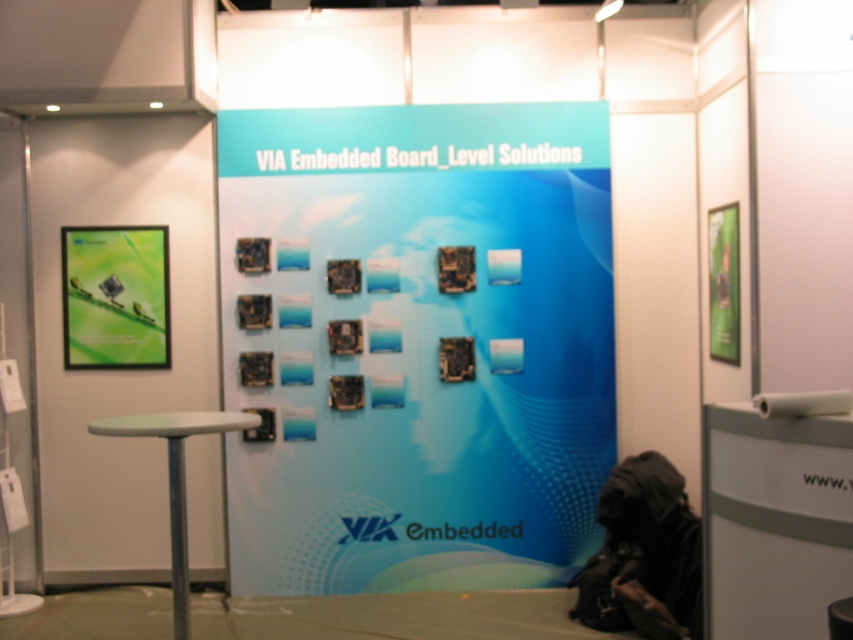
You are standing in front of the exhibition booth and want to locate the blue glossy board at center. According to the coordinates provided, where exactly is it positioned?

The blue glossy board at center is positioned at point coordinates of (415, 342).

You are setting up a new display in the exhibition booth and need to place a rectangular stand that is 1.2 meters wide. You have two options for placement areas based on the existing blue glossy board at center and green glossy poster at upper left. Which object provides a wider space for the stand?

The blue glossy board at center has a greater width than the green glossy poster at upper left, so placing the stand near the blue glossy board at center would provide a wider space for the 1.2 meter stand.